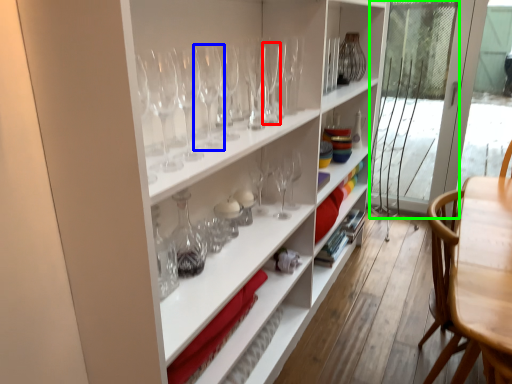
Question: Which object is the closest to the wine glass (highlighted by a red box)? Choose among these: wine glass (highlighted by a blue box) or screen door (highlighted by a green box).

Choices:
 (A) wine glass
 (B) screen door

Answer: (A)